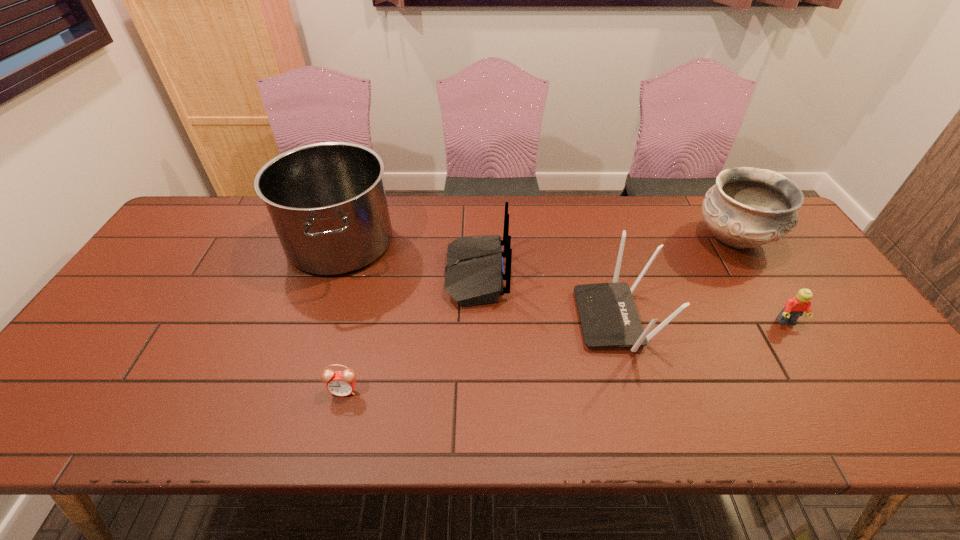
This screenshot has height=540, width=960. I want to click on the tallest object, so click(x=327, y=201).

The width and height of the screenshot is (960, 540). Find the location of `pottery`. pottery is located at coordinates (747, 207).

Where is `the left router`? This screenshot has width=960, height=540. the left router is located at coordinates (474, 274).

Locate an element on the screen. The height and width of the screenshot is (540, 960). the right router is located at coordinates (608, 315).

You are a GUI agent. You are given a task and a screenshot of the screen. Output one action in this format:
    pyautogui.click(x=<x>, y=<y>)
    Task: Click on the Lego
    This screenshot has width=960, height=540.
    Given the screenshot: What is the action you would take?
    pyautogui.click(x=795, y=307)

Where is `the nearest object`? The width and height of the screenshot is (960, 540). the nearest object is located at coordinates (340, 383).

Find the location of `alarm clock`. alarm clock is located at coordinates tap(340, 383).

Locate an element on the screen. This screenshot has width=960, height=540. vacant area situated 0.330m on the left of the tallest object is located at coordinates (179, 242).

Find the location of a particular element. vacant region located 0.060m on the back of the pottery is located at coordinates (711, 203).

You are a GUI agent. You are given a task and a screenshot of the screen. Output one action in this format:
    pyautogui.click(x=<x>, y=<y>)
    Task: Click on the vacant position located on the back of the third object from left to right
    The width and height of the screenshot is (960, 540).
    Given the screenshot: What is the action you would take?
    [x=557, y=274]